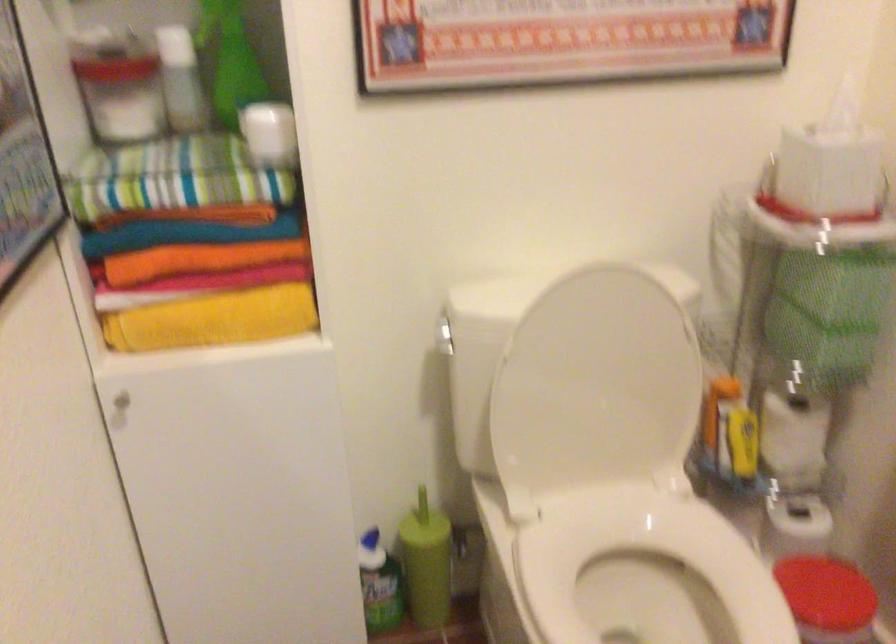
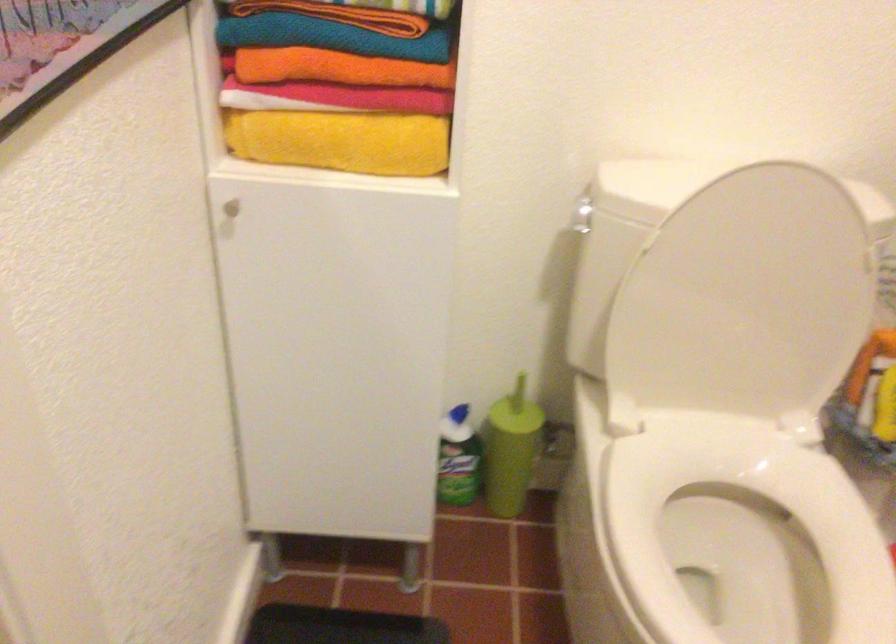
Locate, in the second image, the point that corresponds to the point at 443,335 in the first image.

(581, 214)